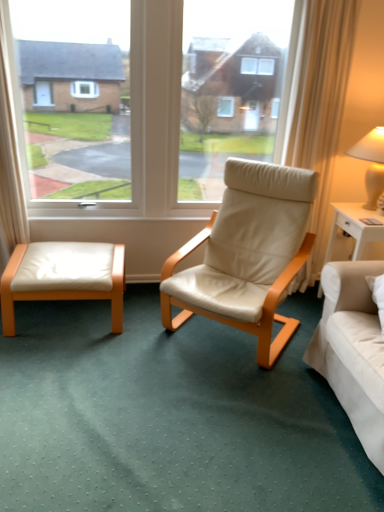
Locate an element on the screen. vacant region to the left of beige leather chair at center is located at coordinates pos(114,350).